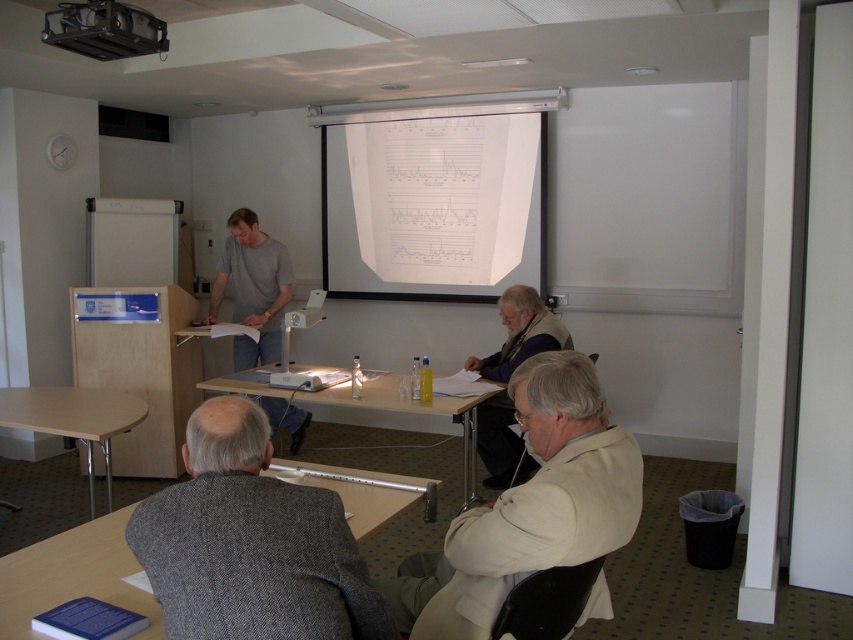
Who is taller, gray cotton shirt at center or metallic projector at upper left?

gray cotton shirt at center

Based on the photo, is gray cotton shirt at center thinner than metallic projector at upper left?

No.

This screenshot has width=853, height=640. I want to click on gray cotton shirt at center, so click(x=252, y=289).

The width and height of the screenshot is (853, 640). What do you see at coordinates (434, 205) in the screenshot? I see `white paper at center` at bounding box center [434, 205].

How distant is white paper at center from wooden table at lower center?

white paper at center and wooden table at lower center are 8.09 feet apart.

Is point (498, 284) positioned before point (30, 504)?

No.

Image resolution: width=853 pixels, height=640 pixels. Identify the location of white paper at center. (434, 205).

Which is behind, point (485, 186) or point (218, 268)?

The point (485, 186) is behind.

This screenshot has width=853, height=640. I want to click on white paper at center, so click(434, 205).